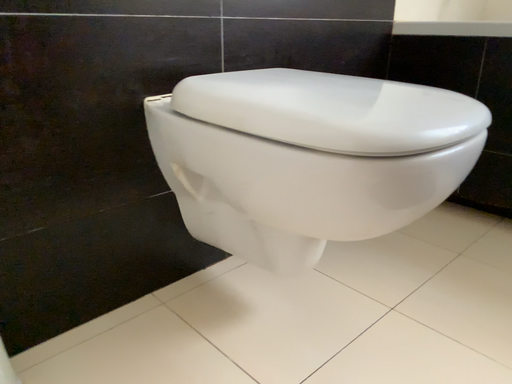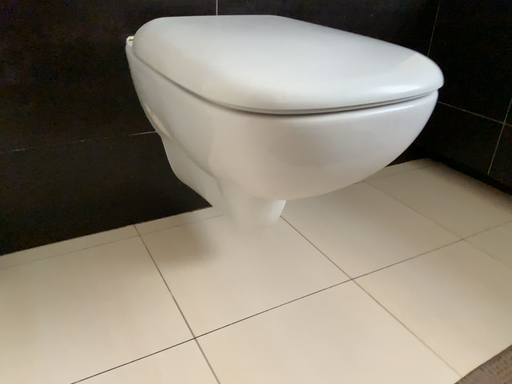
Question: Which way did the camera rotate in the video?

Choices:
 (A) rotated left
 (B) rotated right

Answer: (A)